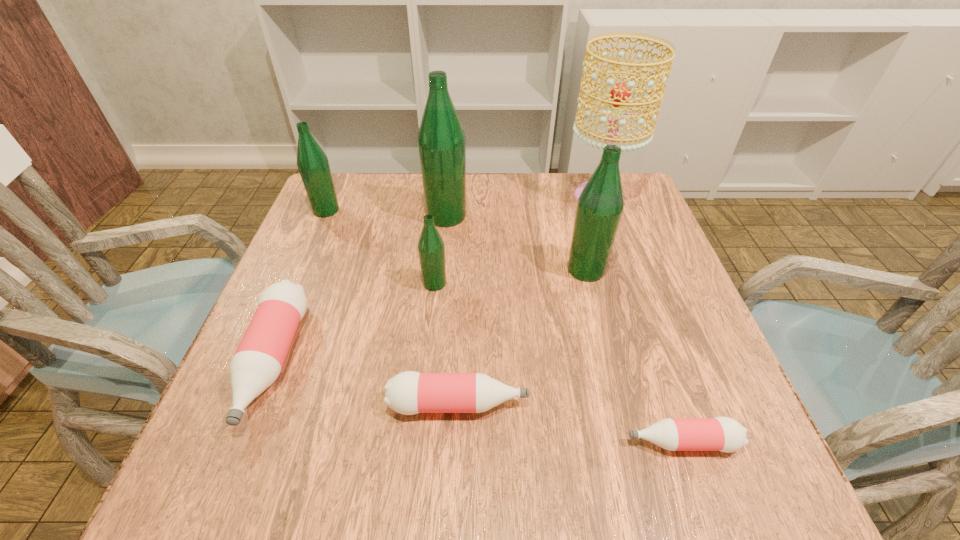
The image size is (960, 540). I want to click on the sixth tallest bottle, so click(x=410, y=392).

The height and width of the screenshot is (540, 960). I want to click on the second biggest pink bottle, so click(x=410, y=392).

Find the location of a particular element. The width and height of the screenshot is (960, 540). the shortest bottle is located at coordinates (724, 434).

The width and height of the screenshot is (960, 540). Find the location of `the shortest object`. the shortest object is located at coordinates (724, 434).

The image size is (960, 540). What are the coordinates of `free point located 0.400m on the left of the lampshade` in the screenshot? It's located at (418, 196).

Locate an element on the screen. The image size is (960, 540). free spot located on the back of the tallest bottle is located at coordinates (450, 174).

The height and width of the screenshot is (540, 960). What are the coordinates of `free space located on the back of the sixth shortest bottle` in the screenshot? It's located at (570, 207).

Where is `vacant point located on the back of the second smallest green bottle`? This screenshot has height=540, width=960. vacant point located on the back of the second smallest green bottle is located at coordinates 338,183.

Where is `vacant area situated on the left of the fourth tallest bottle`? vacant area situated on the left of the fourth tallest bottle is located at coordinates (395, 284).

Locate an element on the screen. This screenshot has height=540, width=960. blank space located with the cap open on the sixth tallest bottle is located at coordinates (732, 404).